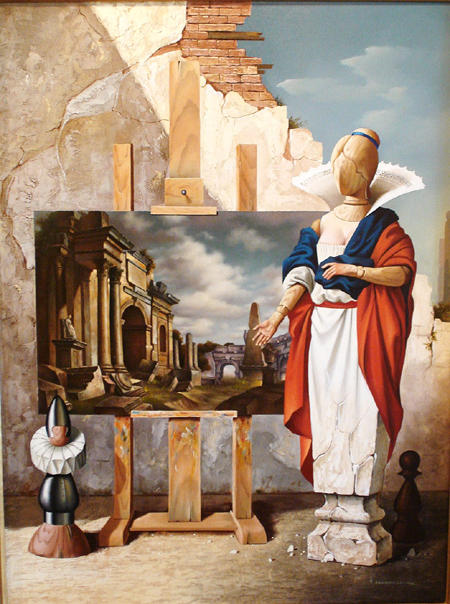
Find the location of a particular element. The image size is (450, 604). broken edge of the wall is located at coordinates (268, 90), (305, 129).